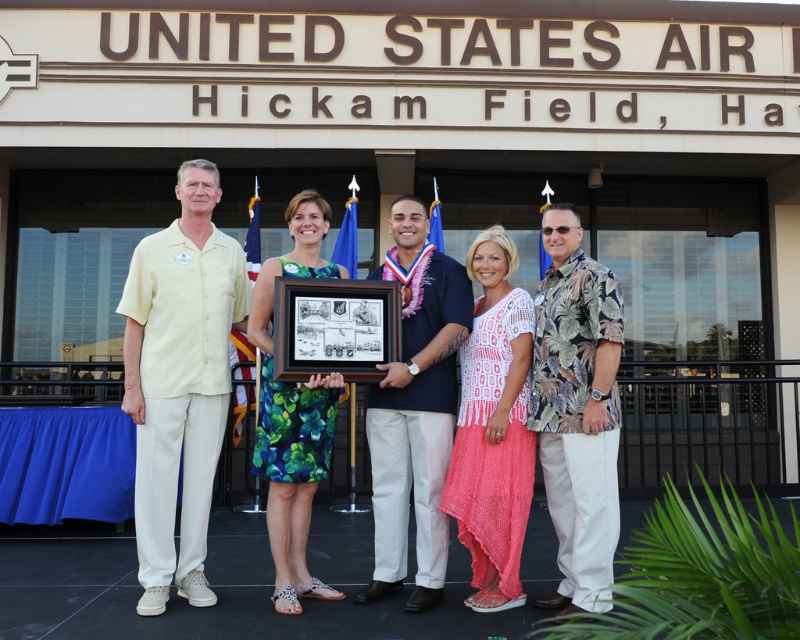
You are taking a photo of the group in front of the building. You notice two points marked at coordinates point (556, 346) and point (416, 205). Which point is closer to your camera lens?

Point (556, 346) is closer to the camera lens than point (416, 205).

Based on the scene description, if someone is looking for the person wearing the dark blue shirt at center, where should they look relative to the hawaiian print shirt at right?

The dark blue shirt at center is behind the hawaiian print shirt at right, so they should look behind the hawaiian print shirt at right to find the person wearing the dark blue shirt at center.